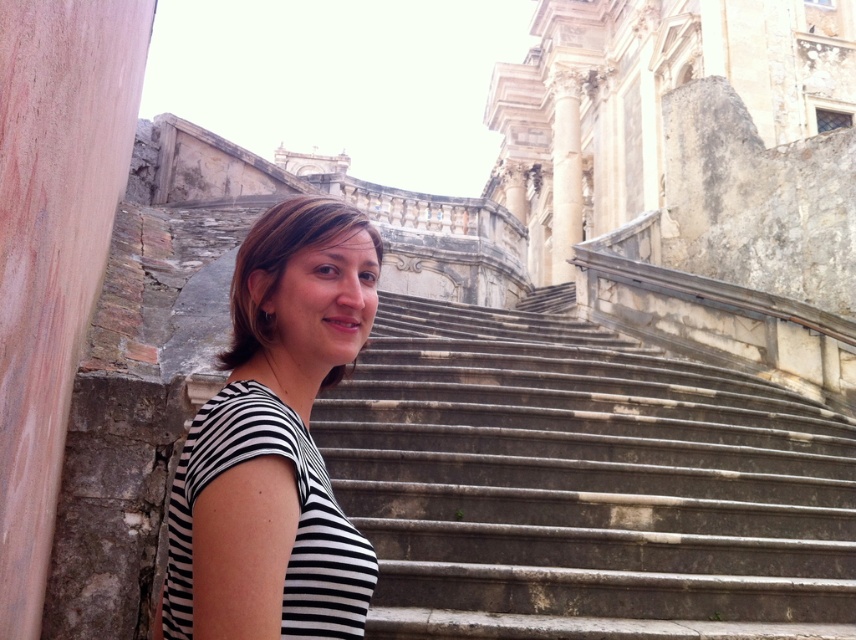
You are a painter who wants to paint the stone stairs at center and the white marble column at upper center. If you have a limited amount of paint, which object should you prioritize to ensure it can be fully painted?

The stone stairs at center might be wider than white marble column at upper center, so you should prioritize painting the stone stairs at center to ensure it can be fully painted with the limited paint.

You are a photographer setting up a shoot in this scene. You need to ensure that the black striped shirt at center and the white marble column at upper center are both visible in the frame. Based on their sizes, which object should you prioritize positioning closer to the camera to maintain their visibility?

The black striped shirt at center should be positioned closer to the camera since it occupies less space than the white marble column at upper center, ensuring both remain visible in the frame.